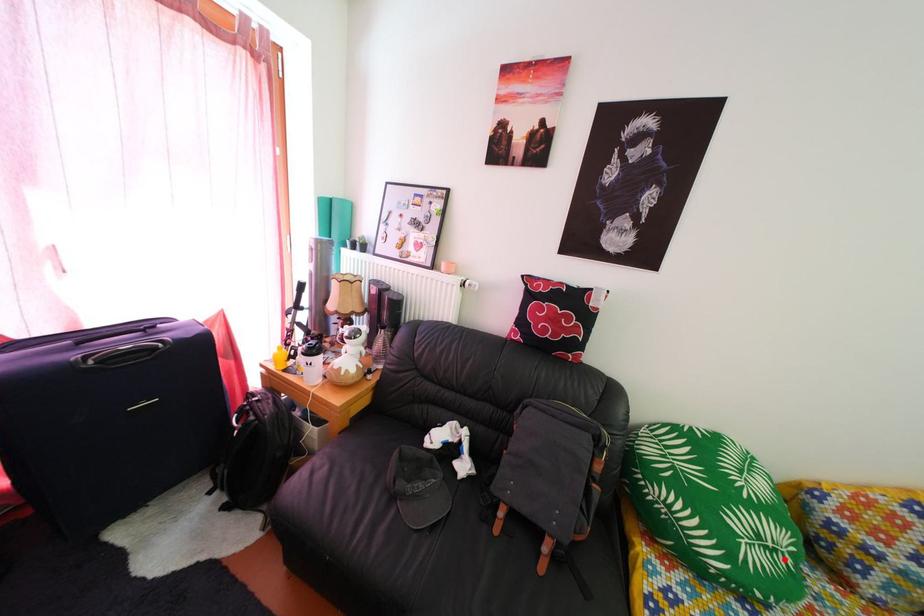
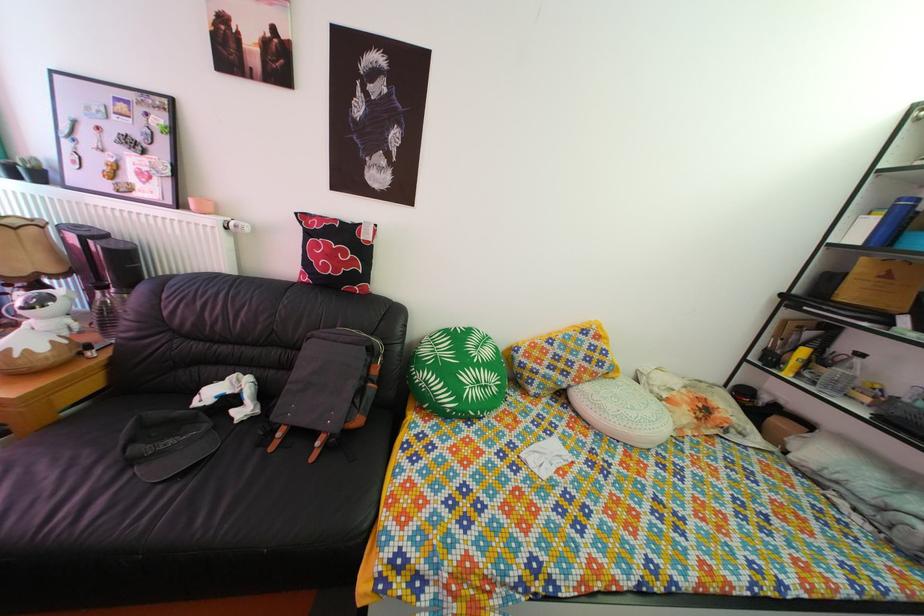
Question: I am providing you with two images of the same scene from different viewpoints. In image1, a red point is highlighted. Considering the same 3D point in image2, which of the following is correct?

Choices:
 (A) It is closer
 (B) It is farther

Answer: (B)